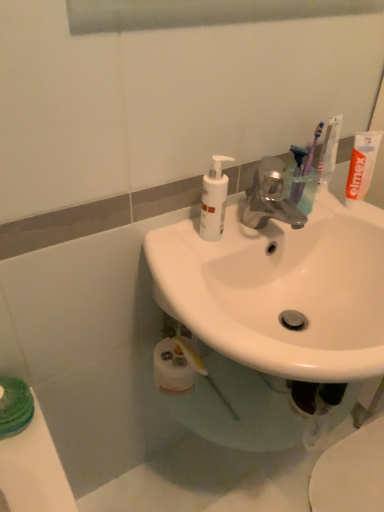
Describe the element at coordinates (351, 473) in the screenshot. The image size is (384, 512). I see `white glossy toilet at lower right` at that location.

What is the approximate height of purple plastic toothbrush at upper right, which appears as the 2th toothbrush when viewed from the left?

purple plastic toothbrush at upper right, which appears as the 2th toothbrush when viewed from the left, is 7.23 inches tall.

In order to face purple plastic toothbrush at upper right, marked as the 2th toothbrush in a right-to-left arrangement, should I rotate leftwards or rightwards?

Rotate right and turn 15.124 degrees.

Describe the element at coordinates (362, 165) in the screenshot. I see `white matte toothpaste at upper right` at that location.

You are a GUI agent. You are given a task and a screenshot of the screen. Output one action in this format:
    pyautogui.click(x=<x>, y=<y>)
    Task: Click on the white glossy toilet at lower right
    
    Given the screenshot: What is the action you would take?
    pyautogui.click(x=351, y=473)

From the image's perspective, between purple plastic toothbrush at upper right, acting as the 3th toothbrush starting from the left, and white glossy sink at center, who is located below?

white glossy sink at center appears lower in the image.

Is purple plastic toothbrush at upper right, the 1th toothbrush from the right, in front of or behind white glossy sink at center in the image?

Clearly, purple plastic toothbrush at upper right, the 1th toothbrush from the right, is behind white glossy sink at center.

Based on the photo, is purple plastic toothbrush at upper right, the 1th toothbrush from the right, not within white glossy sink at center?

Yes, purple plastic toothbrush at upper right, the 1th toothbrush from the right, is outside of white glossy sink at center.

Is white glossy toilet at lower right a part of white matte pump bottle at upper center?

No, white glossy toilet at lower right is not inside white matte pump bottle at upper center.

Where is `cleaning product above the white glossy toilet at lower right (from the image's perspective)`? Image resolution: width=384 pixels, height=512 pixels. cleaning product above the white glossy toilet at lower right (from the image's perspective) is located at coordinates (214, 199).

Is white matte pump bottle at upper center shorter than white glossy toilet at lower right?

In fact, white matte pump bottle at upper center may be taller than white glossy toilet at lower right.

Based on the photo, considering the positions of objects white matte pump bottle at upper center and white glossy toilet at lower right in the image provided, who is behind, white matte pump bottle at upper center or white glossy toilet at lower right?

Positioned behind is white glossy toilet at lower right.

Starting from the translucent plastic toothbrush at upper right, positioned as the third toothbrush in right-to-left order, which toothbrush is the 2nd one to the right? Please provide its 2D coordinates.

[(329, 151)]

Which object is wider, purple plastic toothbrush at upper right, the 1th toothbrush from the right, or translucent plastic toothbrush at upper right, positioned as the third toothbrush in right-to-left order?

translucent plastic toothbrush at upper right, positioned as the third toothbrush in right-to-left order.

From the picture: Is purple plastic toothbrush at upper right, acting as the 3th toothbrush starting from the left, placed right next to translucent plastic toothbrush at upper right, positioned as the third toothbrush in right-to-left order?

Yes, purple plastic toothbrush at upper right, acting as the 3th toothbrush starting from the left, is next to translucent plastic toothbrush at upper right, positioned as the third toothbrush in right-to-left order.

In the scene shown: Which is closer to the camera, [334,135] or [295,152]?

Positioned in front is point [295,152].

From a real-world perspective, is white glossy sink at center beneath purple plastic toothbrush at upper right, marked as the 2th toothbrush in a right-to-left arrangement?

Correct, in the physical world, white glossy sink at center is lower than purple plastic toothbrush at upper right, marked as the 2th toothbrush in a right-to-left arrangement.

Is there a large distance between white glossy sink at center and purple plastic toothbrush at upper right, marked as the 2th toothbrush in a right-to-left arrangement?

No, there isn't a large distance between white glossy sink at center and purple plastic toothbrush at upper right, marked as the 2th toothbrush in a right-to-left arrangement.

Would you say white glossy sink at center is to the left or to the right of purple plastic toothbrush at upper right, which appears as the 2th toothbrush when viewed from the left, in the picture?

From the image, it's evident that white glossy sink at center is to the left of purple plastic toothbrush at upper right, which appears as the 2th toothbrush when viewed from the left.

Is white glossy sink at center spatially inside purple plastic toothbrush at upper right, which appears as the 2th toothbrush when viewed from the left, or outside of it?

white glossy sink at center is spatially situated outside purple plastic toothbrush at upper right, which appears as the 2th toothbrush when viewed from the left.

From the image's perspective, who appears lower, white glossy toilet at lower right or white matte pump bottle at upper center?

From the image's view, white glossy toilet at lower right is below.

From the picture: From a real-world perspective, between white glossy toilet at lower right and white matte pump bottle at upper center, who is vertically higher?

white matte pump bottle at upper center is physically above.

Is white glossy toilet at lower right spatially inside white matte pump bottle at upper center, or outside of it?

white glossy toilet at lower right exists outside the volume of white matte pump bottle at upper center.

Can you confirm if white glossy toilet at lower right is thinner than white matte pump bottle at upper center?

No.

This screenshot has height=512, width=384. I want to click on sink below the purple plastic toothbrush at upper right, the 1th toothbrush from the right (from the image's perspective), so click(x=282, y=290).

From a real-world perspective, which object rests below the other?

white glossy sink at center is physically lower.

Can you confirm if white glossy sink at center is positioned to the right of purple plastic toothbrush at upper right, the 1th toothbrush from the right?

No, white glossy sink at center is not to the right of purple plastic toothbrush at upper right, the 1th toothbrush from the right.

Which of these two, white glossy sink at center or purple plastic toothbrush at upper right, acting as the 3th toothbrush starting from the left, is thinner?

Thinner between the two is purple plastic toothbrush at upper right, acting as the 3th toothbrush starting from the left.

Which is more to the left, white glossy toilet at lower right or white matte toothpaste at upper right?

From the viewer's perspective, white matte toothpaste at upper right appears more on the left side.

In the scene shown: Which of these two, white glossy toilet at lower right or white matte toothpaste at upper right, is smaller?

Smaller between the two is white matte toothpaste at upper right.

Does white glossy toilet at lower right have a greater height compared to white matte toothpaste at upper right?

No.

Which object is closer to the camera taking this photo, white glossy toilet at lower right or white matte toothpaste at upper right?

white matte toothpaste at upper right is closer to the camera.

This screenshot has width=384, height=512. What are the coordinates of `sink located on the left of purple plastic toothbrush at upper right, the 1th toothbrush from the right` in the screenshot? It's located at pyautogui.click(x=282, y=290).

Locate an element on the screen. Image resolution: width=384 pixels, height=512 pixels. cleaning product in front of the white glossy toilet at lower right is located at coordinates (214, 199).

Considering their positions, is purple plastic toothbrush at upper right, acting as the 3th toothbrush starting from the left, positioned closer to white matte toothpaste at upper right than white glossy sink at center?

purple plastic toothbrush at upper right, acting as the 3th toothbrush starting from the left, is closer to white matte toothpaste at upper right.

Based on their spatial positions, is purple plastic toothbrush at upper right, the 1th toothbrush from the right, or white matte toothpaste at upper right closer to white glossy sink at center?

white matte toothpaste at upper right lies closer to white glossy sink at center than the other object.

Considering their positions, is white matte toothpaste at upper right positioned further to purple plastic toothbrush at upper right, marked as the 2th toothbrush in a right-to-left arrangement, than purple plastic toothbrush at upper right, the 1th toothbrush from the right?

white matte toothpaste at upper right lies further to purple plastic toothbrush at upper right, marked as the 2th toothbrush in a right-to-left arrangement, than the other object.

Based on their spatial positions, is white matte pump bottle at upper center or purple plastic toothbrush at upper right, the 1th toothbrush from the right, further from translucent plastic toothbrush at upper right, positioned as the third toothbrush in right-to-left order?

Based on the image, white matte pump bottle at upper center appears to be further to translucent plastic toothbrush at upper right, positioned as the third toothbrush in right-to-left order.

When comparing their distances from white matte toothpaste at upper right, does translucent plastic toothbrush at upper right, placed as the first toothbrush when sorted from left to right, or white glossy sink at center seem further?

white glossy sink at center.

Which object lies nearer to the anchor point translucent plastic toothbrush at upper right, placed as the first toothbrush when sorted from left to right, purple plastic toothbrush at upper right, acting as the 3th toothbrush starting from the left, or white glossy toilet at lower right?

Based on the image, purple plastic toothbrush at upper right, acting as the 3th toothbrush starting from the left, appears to be nearer to translucent plastic toothbrush at upper right, placed as the first toothbrush when sorted from left to right.

Which object lies further to the anchor point purple plastic toothbrush at upper right, the 1th toothbrush from the right, translucent plastic toothbrush at upper right, placed as the first toothbrush when sorted from left to right, or white glossy toilet at lower right?

Among the two, white glossy toilet at lower right is located further to purple plastic toothbrush at upper right, the 1th toothbrush from the right.

Which object lies nearer to the anchor point white matte pump bottle at upper center, white glossy sink at center or purple plastic toothbrush at upper right, which appears as the 2th toothbrush when viewed from the left?

white glossy sink at center.

Where is `sink between purple plastic toothbrush at upper right, which appears as the 2th toothbrush when viewed from the left, and white glossy toilet at lower right from top to bottom`? The height and width of the screenshot is (512, 384). sink between purple plastic toothbrush at upper right, which appears as the 2th toothbrush when viewed from the left, and white glossy toilet at lower right from top to bottom is located at coordinates (282, 290).

The height and width of the screenshot is (512, 384). Find the location of `toothpaste located between white glossy sink at center and translucent plastic toothbrush at upper right, positioned as the third toothbrush in right-to-left order, in the depth direction`. toothpaste located between white glossy sink at center and translucent plastic toothbrush at upper right, positioned as the third toothbrush in right-to-left order, in the depth direction is located at coordinates (362, 165).

Image resolution: width=384 pixels, height=512 pixels. Find the location of `toothpaste between white glossy sink at center and purple plastic toothbrush at upper right, which appears as the 2th toothbrush when viewed from the left, in the front-back direction`. toothpaste between white glossy sink at center and purple plastic toothbrush at upper right, which appears as the 2th toothbrush when viewed from the left, in the front-back direction is located at coordinates (362, 165).

This screenshot has width=384, height=512. Identify the location of toothpaste between white glossy sink at center and purple plastic toothbrush at upper right, acting as the 3th toothbrush starting from the left, along the z-axis. (362, 165).